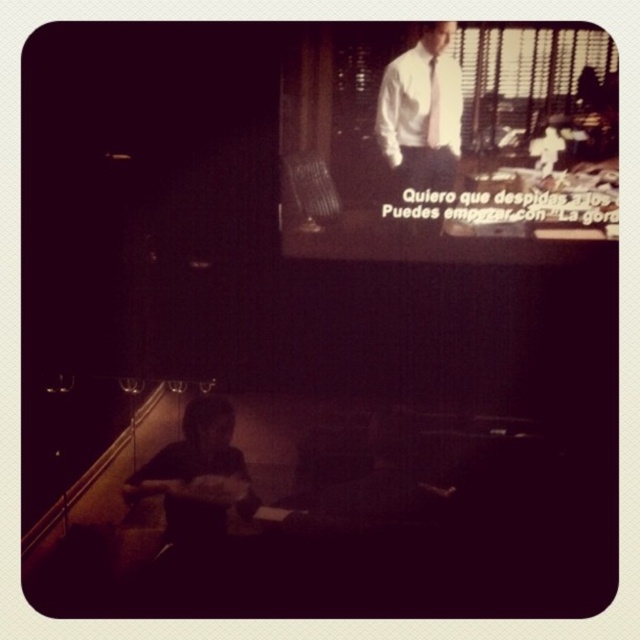
You are a stagehand in a theater. You need to place a small microphone stand exactly at the position where the white shirt and tie at upper center is located. What coordinates should you use to place the microphone stand?

You should place the microphone stand at coordinates point (x=420, y=113) where the white shirt and tie at upper center is located.